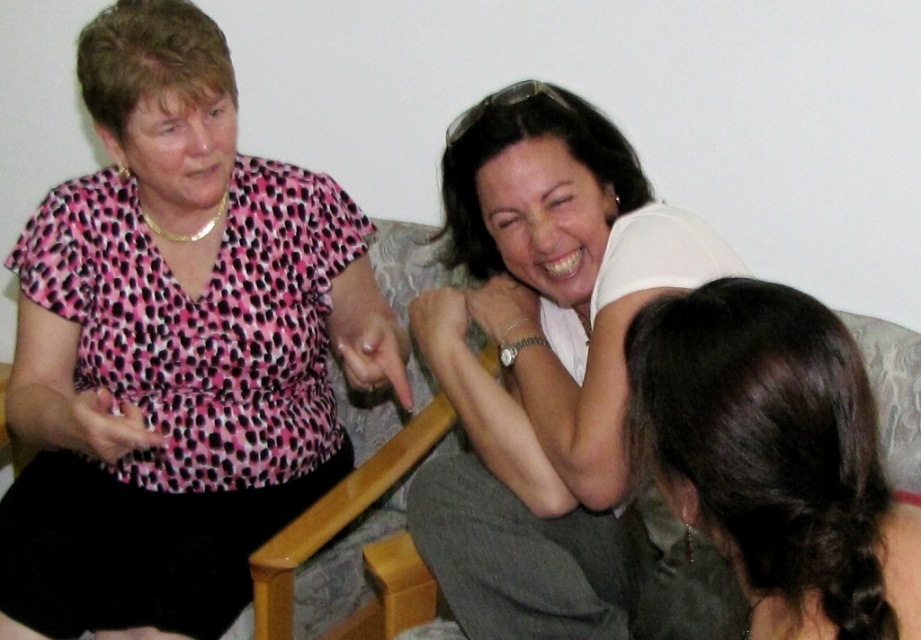
Question: Which of these objects is positioned closest to the patterned fabric couch at center?

Choices:
 (A) white matte shirt at upper center
 (B) pink dotted blouse at left

Answer: (A)

Question: Which object appears farthest from the camera in this image?

Choices:
 (A) patterned fabric couch at center
 (B) pink dotted blouse at left

Answer: (A)

Question: Is white matte shirt at upper center closer to camera compared to patterned fabric couch at center?

Choices:
 (A) no
 (B) yes

Answer: (B)

Question: Which point is closer to the camera taking this photo?

Choices:
 (A) (100, 209)
 (B) (838, 477)
 (C) (451, 360)
 (D) (616, 477)

Answer: (B)

Question: From the image, what is the correct spatial relationship of pink dotted blouse at left in relation to patterned fabric couch at center?

Choices:
 (A) right
 (B) left

Answer: (B)

Question: Does white matte shirt at upper center have a larger size compared to patterned fabric couch at center?

Choices:
 (A) yes
 (B) no

Answer: (B)